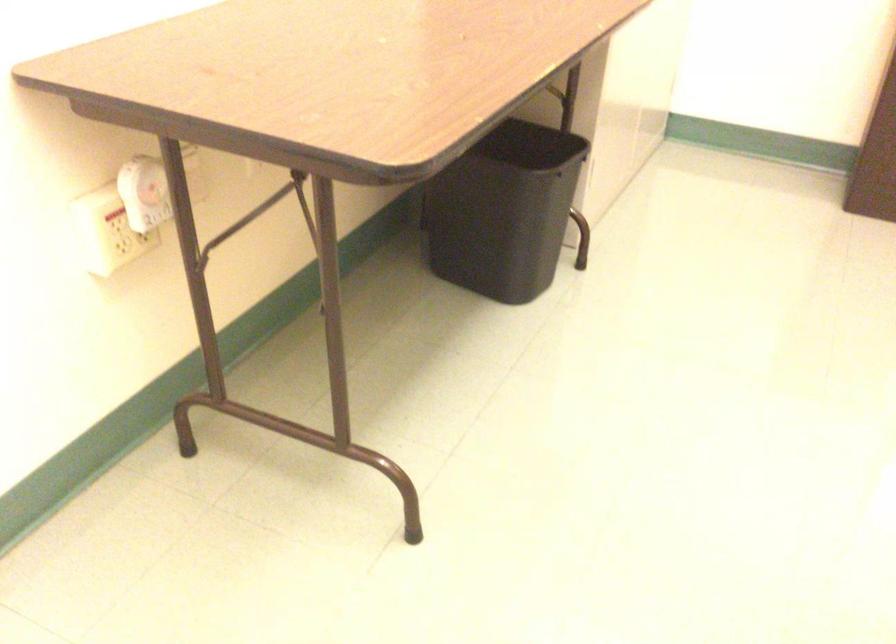
Locate an element on the screen. white timer dial is located at coordinates (145, 193).